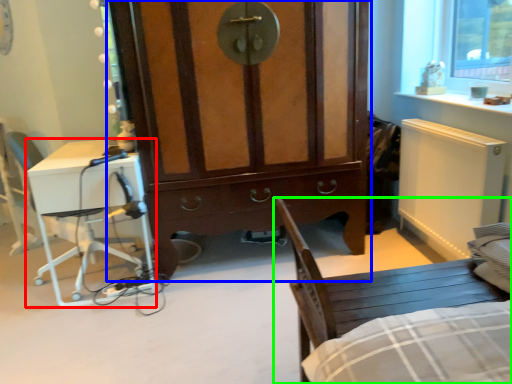
Question: Which is nearer to the desk (highlighted by a red box)? cabinetry (highlighted by a blue box) or chair (highlighted by a green box).

Choices:
 (A) cabinetry
 (B) chair

Answer: (A)